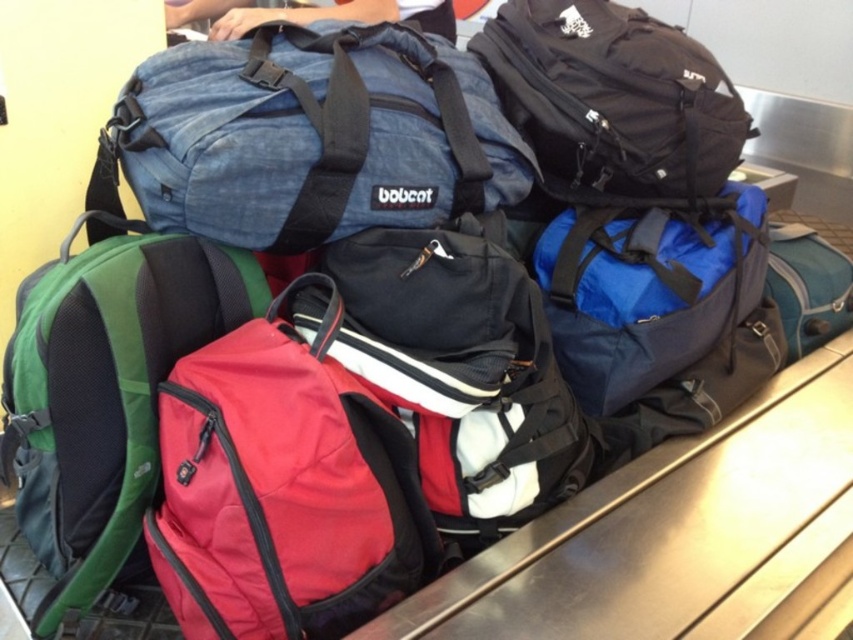
Can you confirm if denim fabric duffel at center is taller than matte green backpack at lower left?

Incorrect, denim fabric duffel at center's height is not larger of matte green backpack at lower left's.

I want to click on denim fabric duffel at center, so click(309, 136).

Can you confirm if matte green backpack at lower left is positioned below black fabric backpack at upper right?

Yes.

Can you confirm if matte green backpack at lower left is smaller than black fabric backpack at upper right?

No, matte green backpack at lower left is not smaller than black fabric backpack at upper right.

Does point (223, 324) come in front of point (672, 76)?

Yes, it is.

At what (x,y) coordinates should I click in order to perform the action: click on matte green backpack at lower left. Please return your answer as a coordinate pair (x, y). Looking at the image, I should click on (103, 392).

Is denim fabric duffel at center above black fabric backpack at upper right?

Actually, denim fabric duffel at center is below black fabric backpack at upper right.

Who is lower down, denim fabric duffel at center or black fabric backpack at upper right?

denim fabric duffel at center

The width and height of the screenshot is (853, 640). What do you see at coordinates (309, 136) in the screenshot? I see `denim fabric duffel at center` at bounding box center [309, 136].

Locate an element on the screen. denim fabric duffel at center is located at coordinates (309, 136).